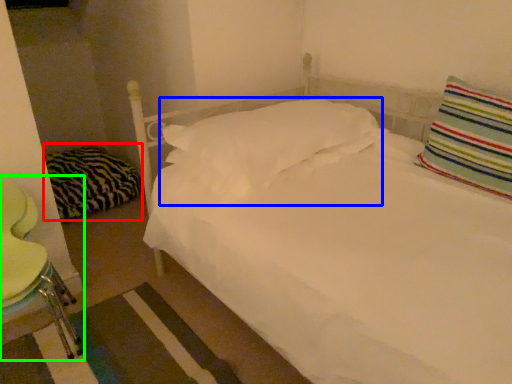
Question: Which is farther away from pillow (highlighted by a red box)? pillow (highlighted by a blue box) or swivel chair (highlighted by a green box)?

Choices:
 (A) pillow
 (B) swivel chair

Answer: (A)